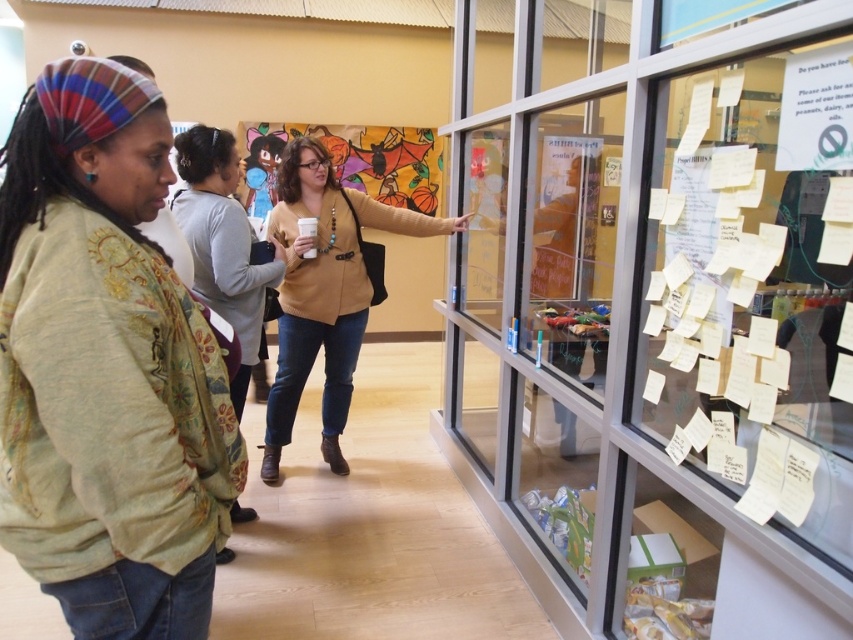
You are standing in front of the display case and want to reach the matte brown sweater at center. Is it within your arm reach?

The matte brown sweater at center is 2.61 meters from viewer, which is beyond typical arm reach. You would need to move closer to reach it.